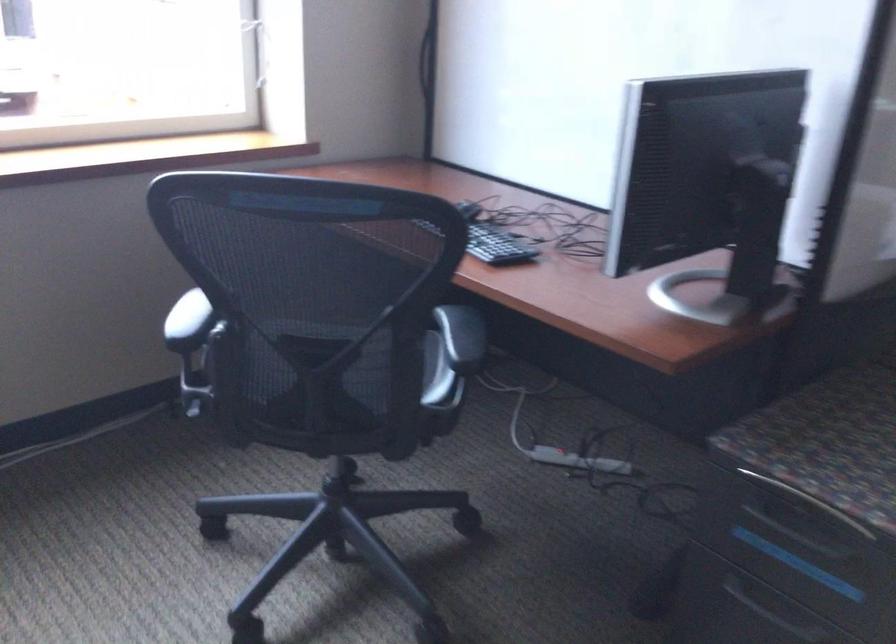
The width and height of the screenshot is (896, 644). What are the coordinates of `chair sitting surface` in the screenshot? It's located at (435, 373).